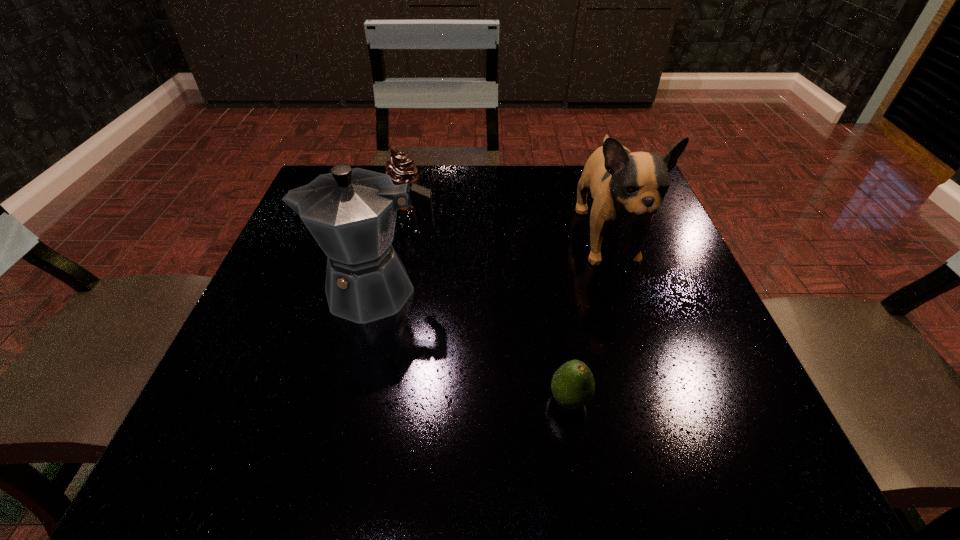
The width and height of the screenshot is (960, 540). In order to click on vacant space at the far left corner of the desktop in this screenshot , I will do `click(378, 170)`.

The width and height of the screenshot is (960, 540). In order to click on vacant region at the near left corner of the desktop in this screenshot , I will do `click(262, 456)`.

At what (x,y) coordinates should I click in order to perform the action: click on free space between the coffeepot and the shortest object. Please return your answer as a coordinate pair (x, y). The width and height of the screenshot is (960, 540). Looking at the image, I should click on (473, 345).

This screenshot has width=960, height=540. What are the coordinates of `vacant point located between the coffeepot and the rightmost object` in the screenshot? It's located at (492, 264).

The height and width of the screenshot is (540, 960). Find the location of `empty space that is in between the nearest object and the coffeepot`. empty space that is in between the nearest object and the coffeepot is located at coordinates (473, 345).

The height and width of the screenshot is (540, 960). What are the coordinates of `vacant area between the shortest object and the second shortest object` in the screenshot? It's located at click(488, 303).

This screenshot has width=960, height=540. I want to click on vacant region between the coffeepot and the avocado, so click(x=473, y=345).

Image resolution: width=960 pixels, height=540 pixels. Identify the location of free space between the icecream and the rightmost object. (507, 222).

Image resolution: width=960 pixels, height=540 pixels. In order to click on free space between the icecream and the puppy in this screenshot , I will do `click(507, 222)`.

Where is `blank region between the puppy and the avocado`? This screenshot has height=540, width=960. blank region between the puppy and the avocado is located at coordinates (588, 319).